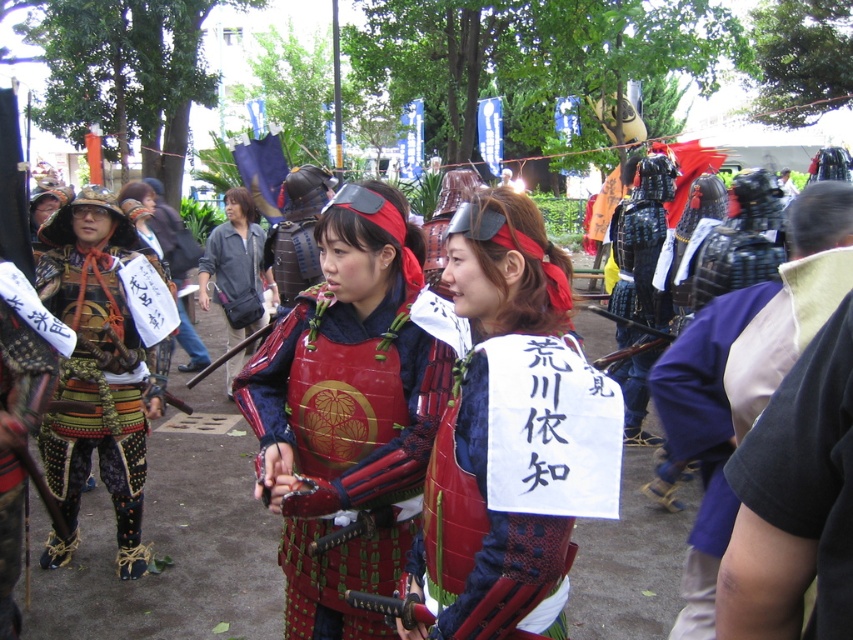
In the scene shown: Who is shorter, dark purple fabric at center or gold metallic armor at left?

Standing shorter between the two is dark purple fabric at center.

Is dark purple fabric at center shorter than gold metallic armor at left?

Indeed, dark purple fabric at center has a lesser height compared to gold metallic armor at left.

Find the location of `dark purple fabric at center`. dark purple fabric at center is located at coordinates (743, 376).

Is black fabric shirt at right further to the viewer compared to gold metallic armor at left?

No, black fabric shirt at right is closer to the viewer.

Identify the location of black fabric shirt at right. The width and height of the screenshot is (853, 640). (795, 500).

At what (x,y) coordinates should I click in order to perform the action: click on black fabric shirt at right. Please return your answer as a coordinate pair (x, y). Image resolution: width=853 pixels, height=640 pixels. Looking at the image, I should click on (795, 500).

Between point (641, 227) and point (161, 244), which one is positioned in front?

Point (641, 227) is in front.

From the picture: Does shiny black armor at center-right have a lesser height compared to red lacquered armor at center?

No.

Is point (651, 224) farther from camera compared to point (196, 362)?

That is False.

Locate an element on the screen. The width and height of the screenshot is (853, 640). shiny black armor at center-right is located at coordinates (635, 257).